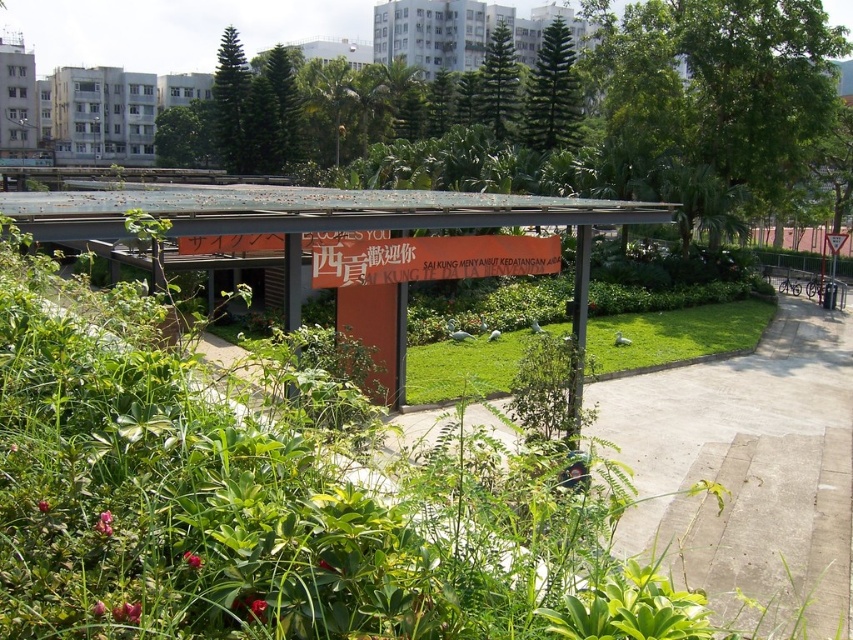
You are a park visitor who wants to take a photo of the metallic orange signboard at center and the green grass at center. Which object should you focus on first if you want to include both in the frame without moving the camera?

The metallic orange signboard at center has a larger size compared to green grass at center, so you should focus on the metallic orange signboard at center first to ensure it fits in the frame before adjusting for the smaller green grass at center.

You are a gardener who needs to plant a new flower bed. You see the metallic orange signboard at center and the green grass at center. Which object is taller and should be considered for space planning?

The metallic orange signboard at center is much taller than the green grass at center, so it should be considered for space planning.